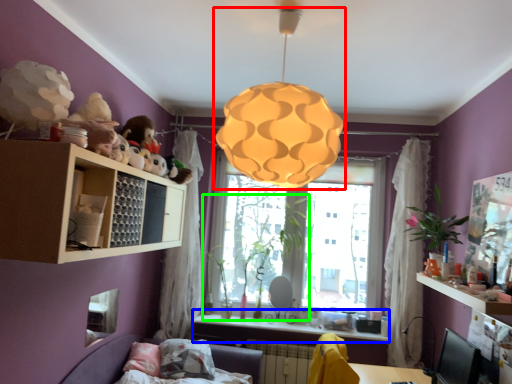
Question: Estimate the real-world distances between objects in this image. Which object is farther from lamp (highlighted by a red box), counter top (highlighted by a blue box) or plant (highlighted by a green box)?

Choices:
 (A) counter top
 (B) plant

Answer: (A)